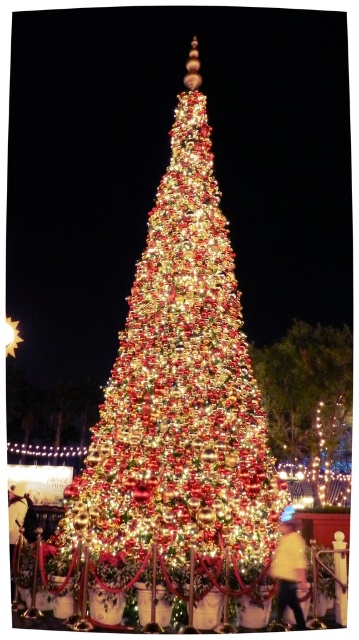
Question: Which point is farther to the camera?

Choices:
 (A) (292, 545)
 (B) (12, 577)
 (C) (267, 416)

Answer: (C)

Question: Does yellow cotton shirt at lower right have a smaller size compared to silk red dress at lower left?

Choices:
 (A) yes
 (B) no

Answer: (A)

Question: Does yellow cotton shirt at lower right come behind silk red dress at lower left?

Choices:
 (A) yes
 (B) no

Answer: (B)

Question: Is shiny gold ornaments at center to the right of yellow cotton shirt at lower right from the viewer's perspective?

Choices:
 (A) yes
 (B) no

Answer: (A)

Question: Which object appears closest to the camera in this image?

Choices:
 (A) silk red dress at lower left
 (B) yellow cotton shirt at lower right
 (C) iridescent glass christmas tree at center

Answer: (C)

Question: Among these points, which one is farthest from the camera?

Choices:
 (A) (285, 525)
 (B) (26, 528)
 (C) (342, 387)
 (D) (196, 212)

Answer: (C)